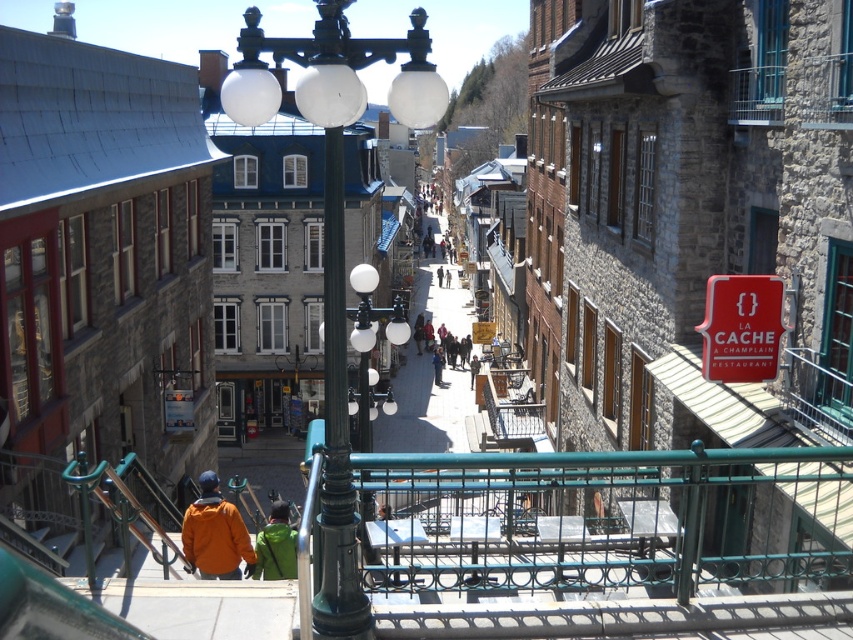
You are a tourist standing on the cobblestone street and see both the orange fleece jacket at lower left and the green fabric jacket at center. Which jacket is closer to you?

The orange fleece jacket at lower left is closer to you because it is in front of the green fabric jacket at center.

You are a tourist walking down the cobblestone street and notice a red matte sign at center right and a green fabric jacket at center. From your perspective, which object is positioned to the right side?

The red matte sign at center right is positioned to the right of the green fabric jacket at center, so the red matte sign at center right is on the right side.